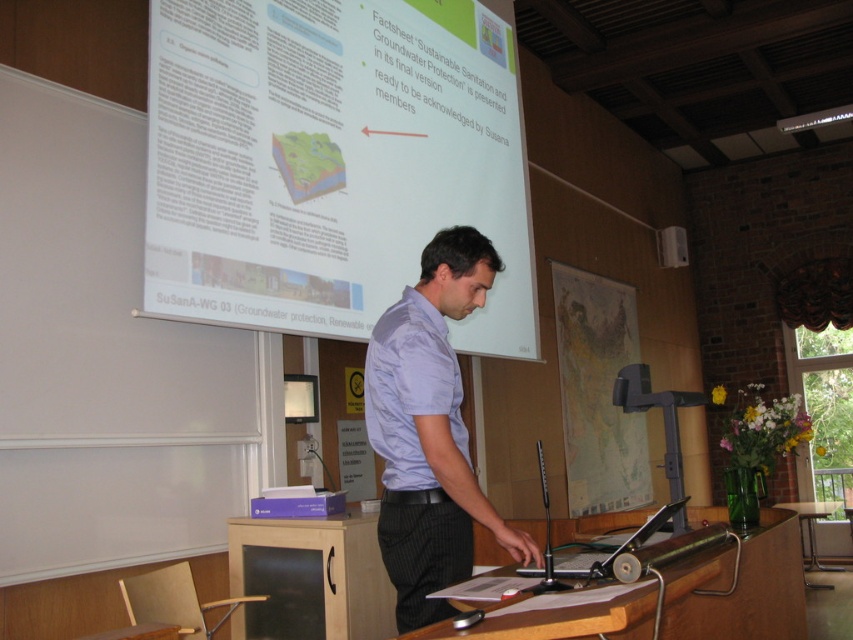
Question: Is the position of light blue cotton shirt at center less distant than that of wooden table at center?

Choices:
 (A) yes
 (B) no

Answer: (A)

Question: Which point is closer to the camera taking this photo?

Choices:
 (A) (844, 566)
 (B) (357, 632)
 (C) (689, 630)

Answer: (C)

Question: Which object is the closest to the wooden cabinet at lower center?

Choices:
 (A) white paper at upper center
 (B) light blue cotton shirt at center
 (C) light blue shirt at center

Answer: (C)

Question: Does white paper at upper center come in front of light blue shirt at center?

Choices:
 (A) no
 (B) yes

Answer: (A)

Question: Where is light blue shirt at center located in relation to wooden table at center in the image?

Choices:
 (A) right
 (B) left

Answer: (B)

Question: Estimate the real-world distances between objects in this image. Which object is farther from the white paper at upper center?

Choices:
 (A) wooden table at center
 (B) wooden at center
 (C) light blue cotton shirt at center
 (D) wooden cabinet at lower center

Answer: (A)